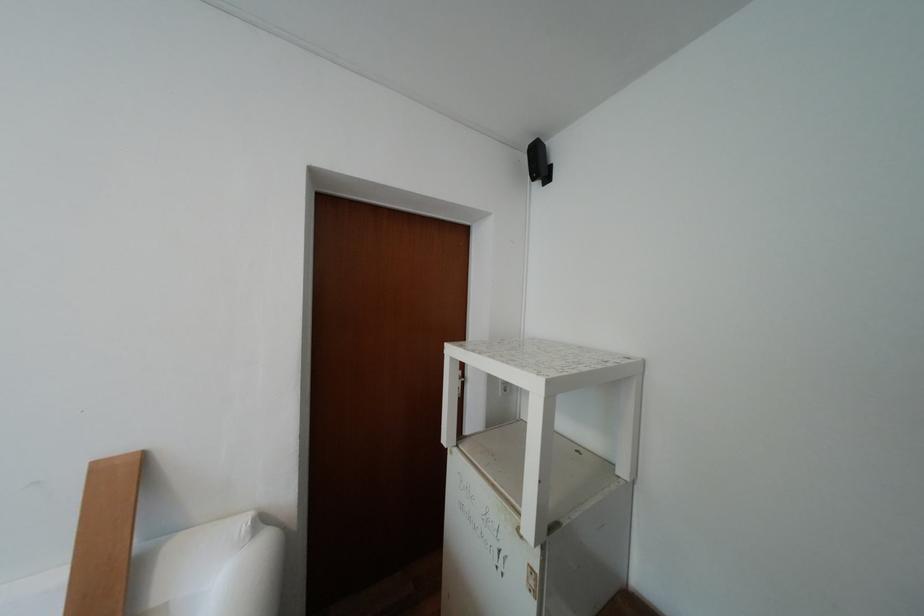
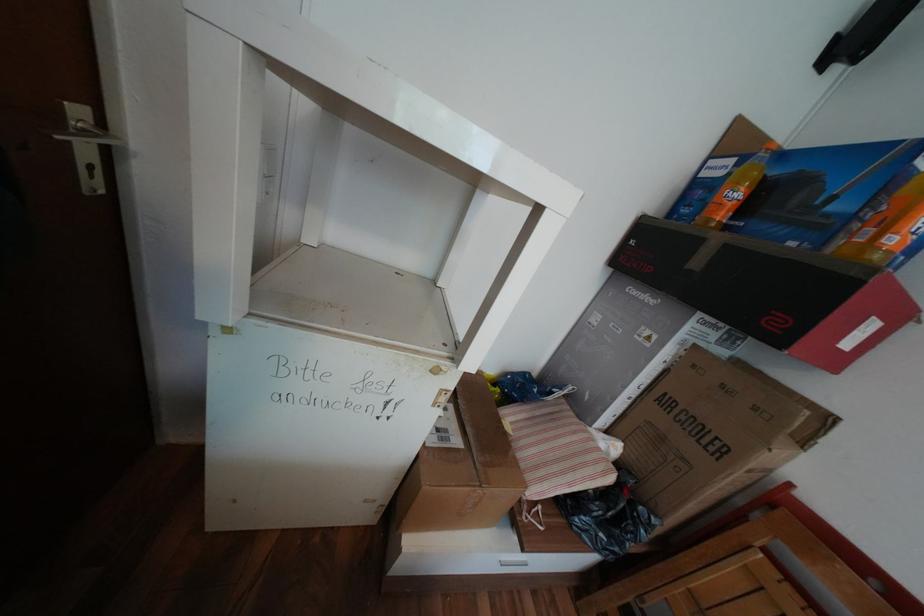
How did the camera likely rotate?

The camera's rotation is toward right-down.